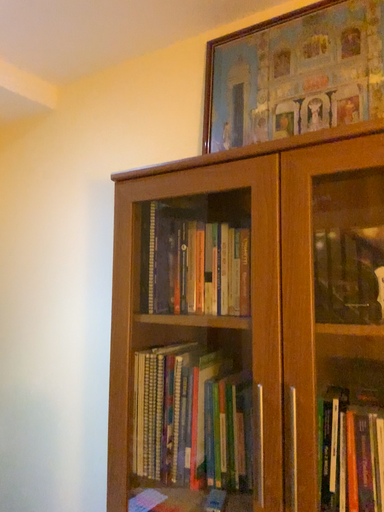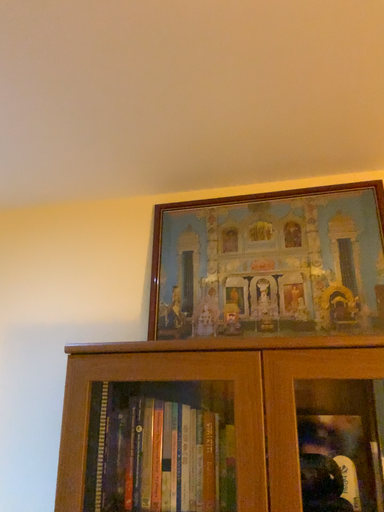
Question: Which way did the camera rotate in the video?

Choices:
 (A) rotated left
 (B) rotated right

Answer: (B)